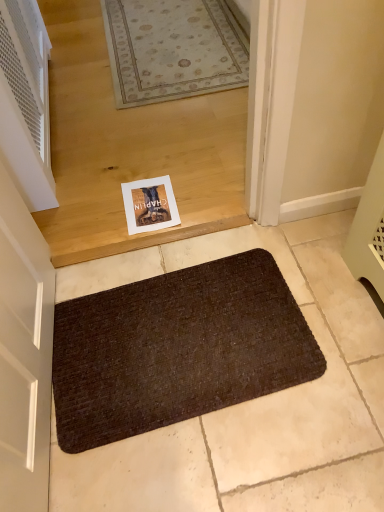
Locate an element on the screen. The width and height of the screenshot is (384, 512). blank space above brown textured bath mat at lower center (from a real-world perspective) is located at coordinates (167, 334).